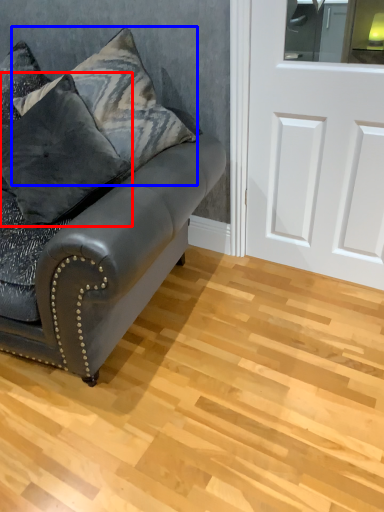
Question: Which point is closer to the camera, pillow (highlighted by a red box) or pillow (highlighted by a blue box)?

Choices:
 (A) pillow
 (B) pillow

Answer: (A)